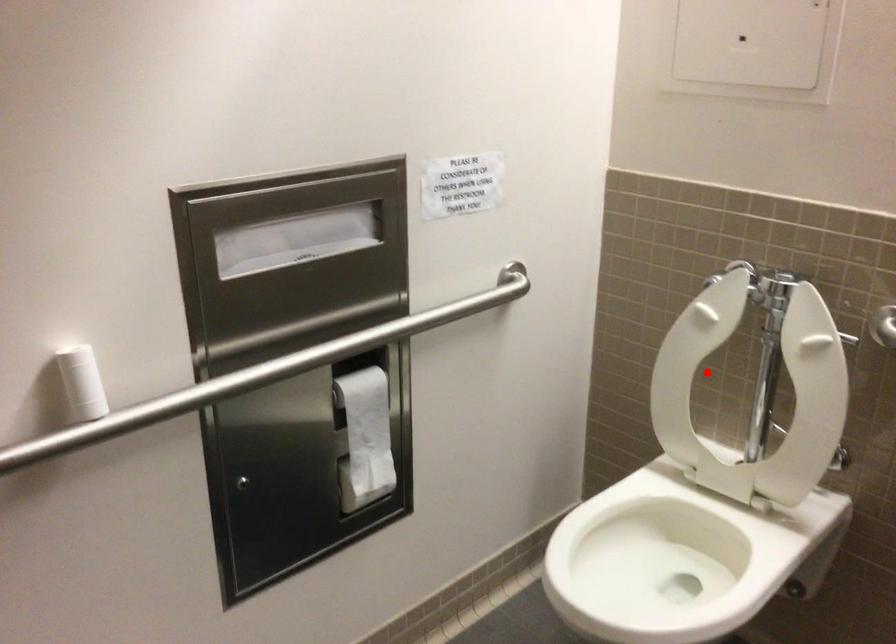
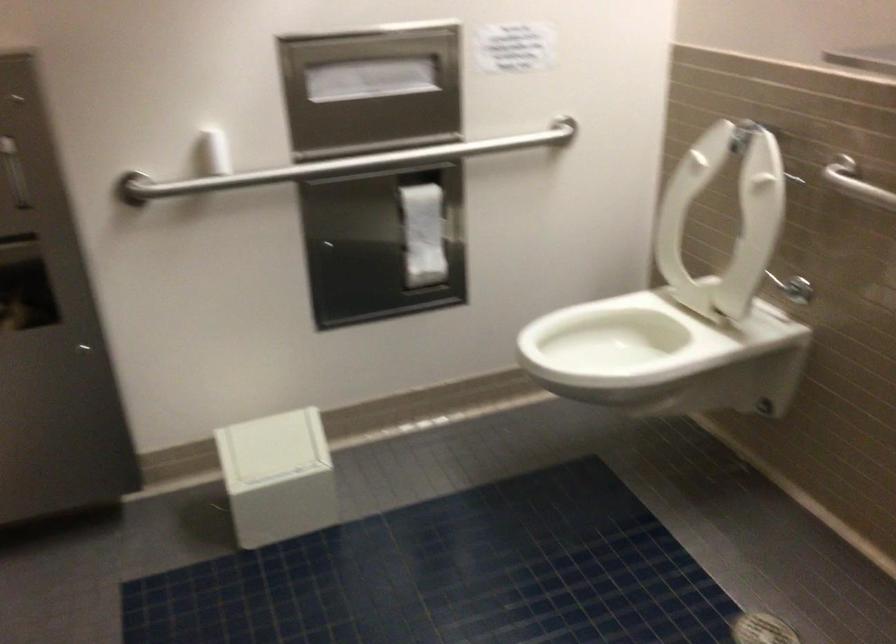
In the second image, find the point that corresponds to the highlighted location in the first image.

(724, 219)